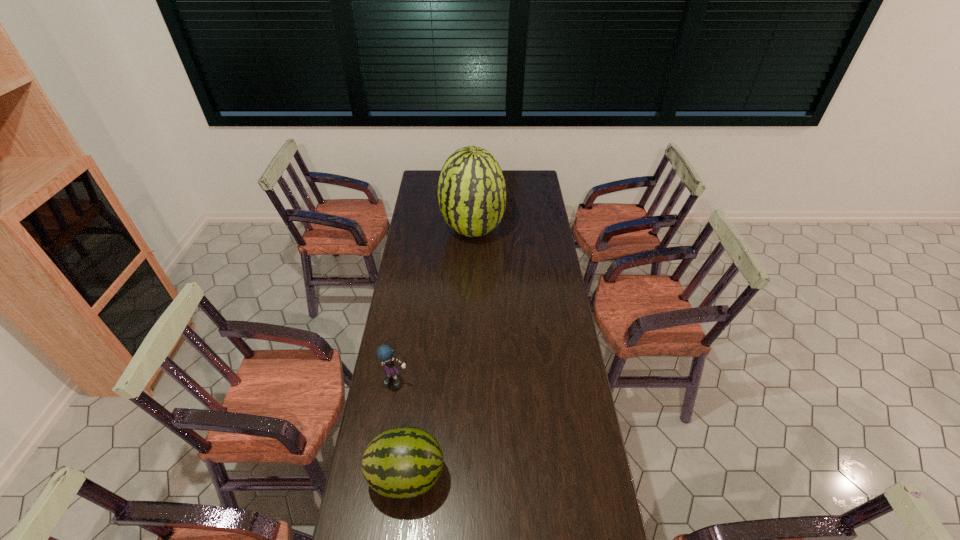
This screenshot has height=540, width=960. In order to click on the farther watermelon in this screenshot , I will do `click(471, 190)`.

The height and width of the screenshot is (540, 960). What are the coordinates of `the taller watermelon` in the screenshot? It's located at (471, 190).

Image resolution: width=960 pixels, height=540 pixels. Identify the location of rag doll. (384, 352).

The height and width of the screenshot is (540, 960). Find the location of `the nearest object`. the nearest object is located at coordinates (405, 462).

In order to click on the nearer watermelon in this screenshot , I will do `click(405, 462)`.

Locate an element on the screen. This screenshot has height=540, width=960. free space located 0.400m on the back of the farther watermelon is located at coordinates (473, 176).

Find the location of a particular element. This screenshot has height=540, width=960. free space located 0.400m on the front-facing side of the rag doll is located at coordinates (x=376, y=504).

Where is `free region located 0.260m at the stem end of the nearer watermelon`? free region located 0.260m at the stem end of the nearer watermelon is located at coordinates (527, 476).

I want to click on rag doll located at the left edge, so click(384, 352).

Find the location of a particular element. The image size is (960, 540). watermelon located at the left edge is located at coordinates (x=405, y=462).